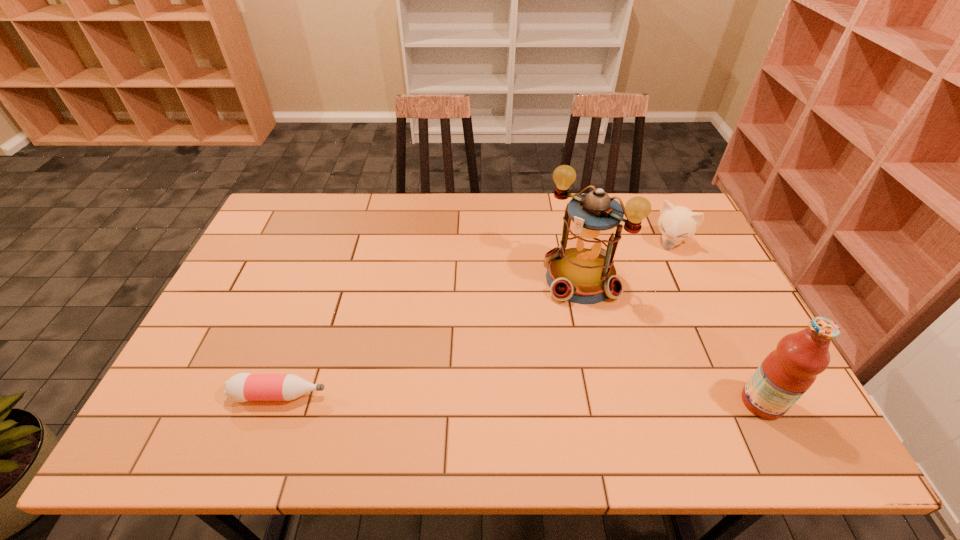
Where is `bottle`? This screenshot has width=960, height=540. bottle is located at coordinates (242, 387).

Locate an element on the screen. This screenshot has height=540, width=960. the shortest object is located at coordinates (242, 387).

Where is `the second tallest object`? The width and height of the screenshot is (960, 540). the second tallest object is located at coordinates (787, 372).

The width and height of the screenshot is (960, 540). Find the location of `lantern`. lantern is located at coordinates (581, 270).

Find the location of `the second object from left to right`. the second object from left to right is located at coordinates (581, 270).

This screenshot has width=960, height=540. In order to click on kitten in this screenshot , I will do `click(677, 223)`.

Find the location of `free location located 0.380m with the cap open on the shortest object`. free location located 0.380m with the cap open on the shortest object is located at coordinates (489, 395).

The height and width of the screenshot is (540, 960). I want to click on free space located 0.360m on the front-facing side of the lantern, so click(x=473, y=379).

At what (x,y) coordinates should I click in order to perform the action: click on vacant space positioned on the front-facing side of the lantern. Please return your answer as a coordinate pair (x, y). Looking at the image, I should click on (527, 329).

Where is `free point located 0.290m on the front-facing side of the lantern`? This screenshot has height=540, width=960. free point located 0.290m on the front-facing side of the lantern is located at coordinates (492, 361).